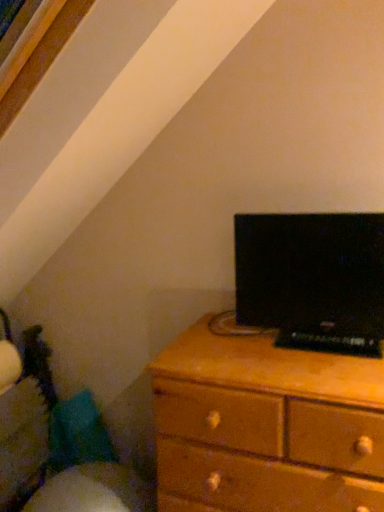
In order to click on free space to the left of black glossy monitor at upper right in this screenshot , I will do `click(229, 353)`.